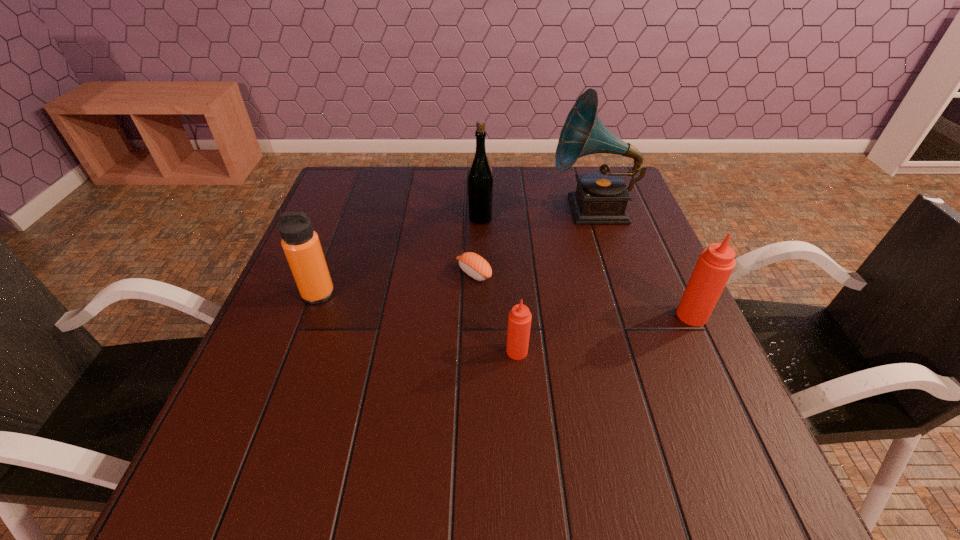
Given the evenly spaced Tabasco sauces in the image, where should an extra Tabasco sauce be added on the left to preserve the spacing? Please point to a vacant space. Please provide its 2D coordinates. Your answer should be formatted as a tuple, i.e. [(x, y)], where the tuple contains the x and y coordinates of a point satisfying the conditions above.

[(312, 394)]